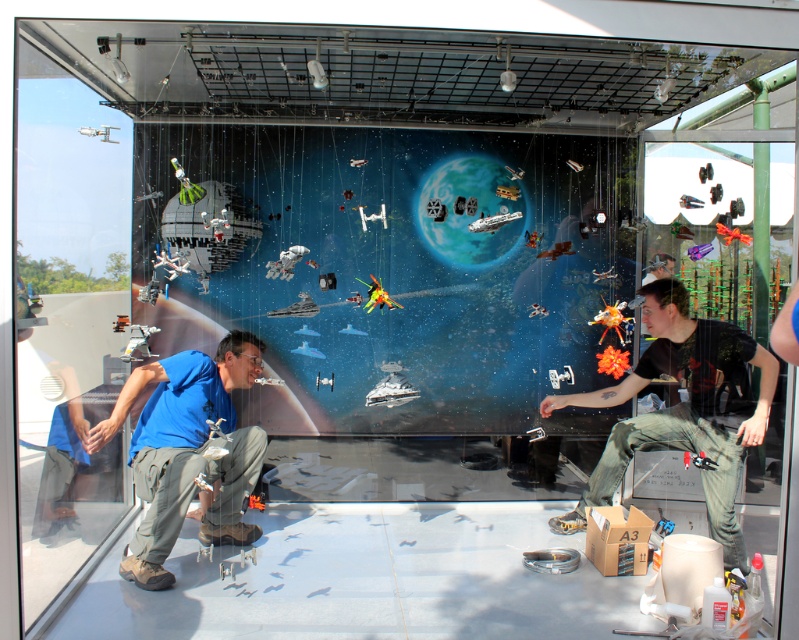
You are standing at the point marked as point (165, 538). You want to move to the entrance of the enclosure. The entrance is located at the point marked as point 0.209, 0.842. Can you walk directly to the entrance without passing through any obstacles?

The distance between the two points is 2.86 meters. Since there are no obstacles mentioned in the scene description, you can walk directly to the entrance without any issues.

You are a visitor standing inside the glass structure and want to exit through the transparent glass door at upper left. You are wearing the dark green pants at right. Can you exit through the door without bending down?

The transparent glass door at upper left is taller than the dark green pants at right, so you can exit without bending down as the door is tall enough to accommodate your height.